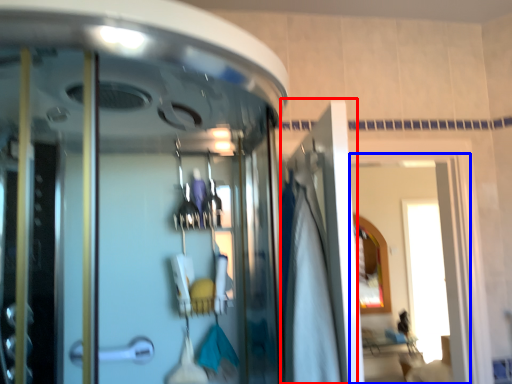
Question: Which point is further to the camera, door (highlighted by a red box) or window (highlighted by a blue box)?

Choices:
 (A) door
 (B) window

Answer: (B)